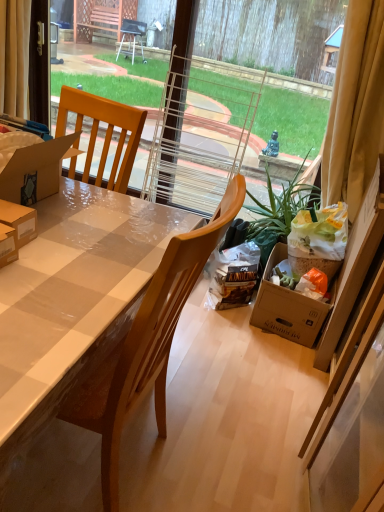
Measure the distance between wooden chair at center and camera.

28.74 inches.

Describe the element at coordinates (147, 344) in the screenshot. Image resolution: width=384 pixels, height=512 pixels. I see `wooden chair at center` at that location.

Image resolution: width=384 pixels, height=512 pixels. What do you see at coordinates (355, 108) in the screenshot? I see `yellow fabric curtain at upper right, marked as the 2th curtain in a left-to-right arrangement` at bounding box center [355, 108].

You are a GUI agent. You are given a task and a screenshot of the screen. Output one action in this format:
    pyautogui.click(x=<x>, y=<y>)
    Task: Click on the beige fabric curtain at upper left, the 2th curtain viewed from the right
    Image resolution: width=384 pixels, height=512 pixels.
    Given the screenshot: What is the action you would take?
    pyautogui.click(x=14, y=56)

Could you tell me if wooden chair at center is turned towards beige fabric curtain at upper left, placed as the first curtain when sorted from left to right?

No, wooden chair at center does not turn towards beige fabric curtain at upper left, placed as the first curtain when sorted from left to right.

Choose the correct answer: Is wooden chair at center inside beige fabric curtain at upper left, the 2th curtain viewed from the right, or outside it?

The correct answer is: outside.

From a real-world perspective, who is located higher, wooden chair at center or beige fabric curtain at upper left, placed as the first curtain when sorted from left to right?

In real-world perspective, beige fabric curtain at upper left, placed as the first curtain when sorted from left to right, is above.

From the image's perspective, who appears lower, beige fabric curtain at upper left, the 2th curtain viewed from the right, or yellow fabric curtain at upper right, marked as the 2th curtain in a left-to-right arrangement?

From the image's view, yellow fabric curtain at upper right, marked as the 2th curtain in a left-to-right arrangement, is below.

Is point (10, 73) closer or farther from the camera than point (351, 111)?

Point (10, 73) appears to be farther away from the viewer than point (351, 111).

Considering the relative positions of beige fabric curtain at upper left, the 2th curtain viewed from the right, and yellow fabric curtain at upper right, marked as the 2th curtain in a left-to-right arrangement, in the image provided, is beige fabric curtain at upper left, the 2th curtain viewed from the right, behind yellow fabric curtain at upper right, marked as the 2th curtain in a left-to-right arrangement,?

Yes.

Which of these two, beige fabric curtain at upper left, the 2th curtain viewed from the right, or yellow fabric curtain at upper right, marked as the 2th curtain in a left-to-right arrangement, is thinner?

With smaller width is beige fabric curtain at upper left, the 2th curtain viewed from the right.

Is beige fabric curtain at upper left, the 2th curtain viewed from the right, positioned with its back to wooden chair at center?

That's not correct — beige fabric curtain at upper left, the 2th curtain viewed from the right, is not looking away from wooden chair at center.

Does point (26, 22) come in front of point (162, 431)?

No, it is behind (162, 431).

Which object is positioned more to the left, beige fabric curtain at upper left, placed as the first curtain when sorted from left to right, or wooden chair at center?

beige fabric curtain at upper left, placed as the first curtain when sorted from left to right.

Is beige fabric curtain at upper left, the 2th curtain viewed from the right, touching wooden chair at center?

No, beige fabric curtain at upper left, the 2th curtain viewed from the right, is not making contact with wooden chair at center.

Does yellow fabric curtain at upper right, marked as the 2th curtain in a left-to-right arrangement, have a greater width compared to wooden chair at center?

No, yellow fabric curtain at upper right, marked as the 2th curtain in a left-to-right arrangement, is not wider than wooden chair at center.

From the image's perspective, which is above, yellow fabric curtain at upper right, which ranks as the first curtain in right-to-left order, or wooden chair at center?

yellow fabric curtain at upper right, which ranks as the first curtain in right-to-left order, from the image's perspective.

Is yellow fabric curtain at upper right, which ranks as the first curtain in right-to-left order, in contact with wooden chair at center?

No, yellow fabric curtain at upper right, which ranks as the first curtain in right-to-left order, is not with wooden chair at center.

Does wooden chair at center have a lesser width compared to yellow fabric curtain at upper right, marked as the 2th curtain in a left-to-right arrangement?

In fact, wooden chair at center might be wider than yellow fabric curtain at upper right, marked as the 2th curtain in a left-to-right arrangement.

Is yellow fabric curtain at upper right, which ranks as the first curtain in right-to-left order, at the back of wooden chair at center?

No, wooden chair at center is not facing away from yellow fabric curtain at upper right, which ranks as the first curtain in right-to-left order.

Looking at this image, is wooden chair at center in contact with yellow fabric curtain at upper right, which ranks as the first curtain in right-to-left order?

No, wooden chair at center is not making contact with yellow fabric curtain at upper right, which ranks as the first curtain in right-to-left order.

In terms of height, does wooden chair at center look taller or shorter compared to yellow fabric curtain at upper right, which ranks as the first curtain in right-to-left order?

wooden chair at center is shorter than yellow fabric curtain at upper right, which ranks as the first curtain in right-to-left order.

I want to click on curtain on the right of beige fabric curtain at upper left, placed as the first curtain when sorted from left to right, so click(355, 108).

From the picture: From a real-world perspective, is yellow fabric curtain at upper right, which ranks as the first curtain in right-to-left order, positioned above or below beige fabric curtain at upper left, the 2th curtain viewed from the right?

yellow fabric curtain at upper right, which ranks as the first curtain in right-to-left order, is situated higher than beige fabric curtain at upper left, the 2th curtain viewed from the right, in the real world.

From the image's perspective, is yellow fabric curtain at upper right, which ranks as the first curtain in right-to-left order, above or below beige fabric curtain at upper left, the 2th curtain viewed from the right?

yellow fabric curtain at upper right, which ranks as the first curtain in right-to-left order, is situated lower than beige fabric curtain at upper left, the 2th curtain viewed from the right, in the image.

This screenshot has width=384, height=512. In order to click on chair in front of the beige fabric curtain at upper left, the 2th curtain viewed from the right in this screenshot , I will do `click(147, 344)`.

Image resolution: width=384 pixels, height=512 pixels. Find the location of `curtain above the yellow fabric curtain at upper right, marked as the 2th curtain in a left-to-right arrangement (from the image's perspective)`. curtain above the yellow fabric curtain at upper right, marked as the 2th curtain in a left-to-right arrangement (from the image's perspective) is located at coordinates (14, 56).

Which object lies further to the anchor point wooden chair at center, beige fabric curtain at upper left, the 2th curtain viewed from the right, or yellow fabric curtain at upper right, marked as the 2th curtain in a left-to-right arrangement?

beige fabric curtain at upper left, the 2th curtain viewed from the right, is positioned further to the anchor wooden chair at center.

Estimate the real-world distances between objects in this image. Which object is further from beige fabric curtain at upper left, placed as the first curtain when sorted from left to right, yellow fabric curtain at upper right, marked as the 2th curtain in a left-to-right arrangement, or wooden chair at center?

yellow fabric curtain at upper right, marked as the 2th curtain in a left-to-right arrangement.

Which object lies nearer to the anchor point yellow fabric curtain at upper right, marked as the 2th curtain in a left-to-right arrangement, beige fabric curtain at upper left, placed as the first curtain when sorted from left to right, or wooden chair at center?

wooden chair at center is positioned closer to the anchor yellow fabric curtain at upper right, marked as the 2th curtain in a left-to-right arrangement.

Looking at this image, based on their spatial positions, is yellow fabric curtain at upper right, marked as the 2th curtain in a left-to-right arrangement, or beige fabric curtain at upper left, placed as the first curtain when sorted from left to right, further from wooden chair at center?

Among the two, beige fabric curtain at upper left, placed as the first curtain when sorted from left to right, is located further to wooden chair at center.

Based on their spatial positions, is wooden chair at center or yellow fabric curtain at upper right, which ranks as the first curtain in right-to-left order, closer to beige fabric curtain at upper left, the 2th curtain viewed from the right?

wooden chair at center is positioned closer to the anchor beige fabric curtain at upper left, the 2th curtain viewed from the right.

Which object lies further to the anchor point yellow fabric curtain at upper right, marked as the 2th curtain in a left-to-right arrangement, wooden chair at center or beige fabric curtain at upper left, placed as the first curtain when sorted from left to right?

Among the two, beige fabric curtain at upper left, placed as the first curtain when sorted from left to right, is located further to yellow fabric curtain at upper right, marked as the 2th curtain in a left-to-right arrangement.

I want to click on chair between beige fabric curtain at upper left, placed as the first curtain when sorted from left to right, and yellow fabric curtain at upper right, which ranks as the first curtain in right-to-left order, so click(147, 344).